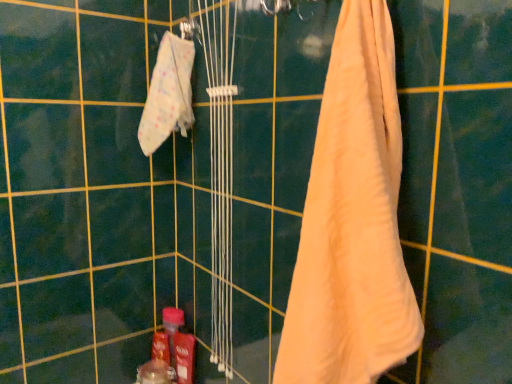
Question: Does point click(x=382, y=326) appear closer or farther from the camera than point click(x=169, y=357)?

Choices:
 (A) farther
 (B) closer

Answer: (B)

Question: From a real-world perspective, is beige cotton towel at right, which is the second towel in back-to-front order, physically located above or below translucent plastic bottle at lower center?

Choices:
 (A) below
 (B) above

Answer: (B)

Question: Considering the real-world distances, which object is closest to the translucent plastic bottle at lower center?

Choices:
 (A) white fabric towel at upper left, marked as the 1th towel in a back-to-front arrangement
 (B) beige cotton towel at right, which is the second towel in back-to-front order

Answer: (A)

Question: Which object is the farthest from the beige cotton towel at right, the 1th towel positioned from the right?

Choices:
 (A) white fabric towel at upper left, which is the second towel from front to back
 (B) translucent plastic bottle at lower center

Answer: (B)